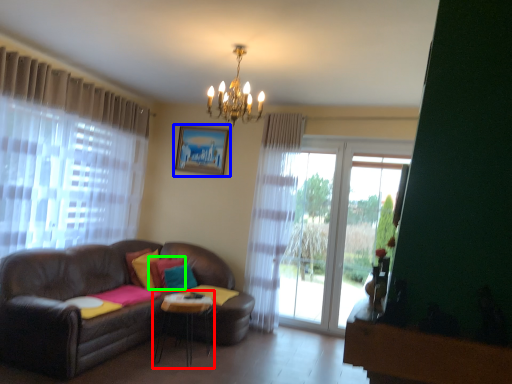
Question: Which is farther away from table (highlighted by a red box)? picture frame (highlighted by a blue box) or pillow (highlighted by a green box)?

Choices:
 (A) picture frame
 (B) pillow

Answer: (A)